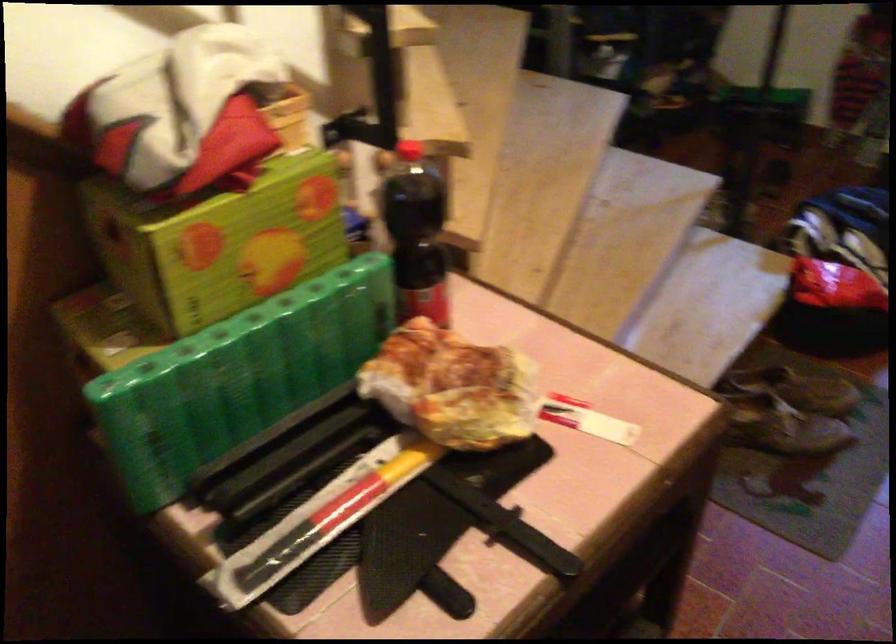
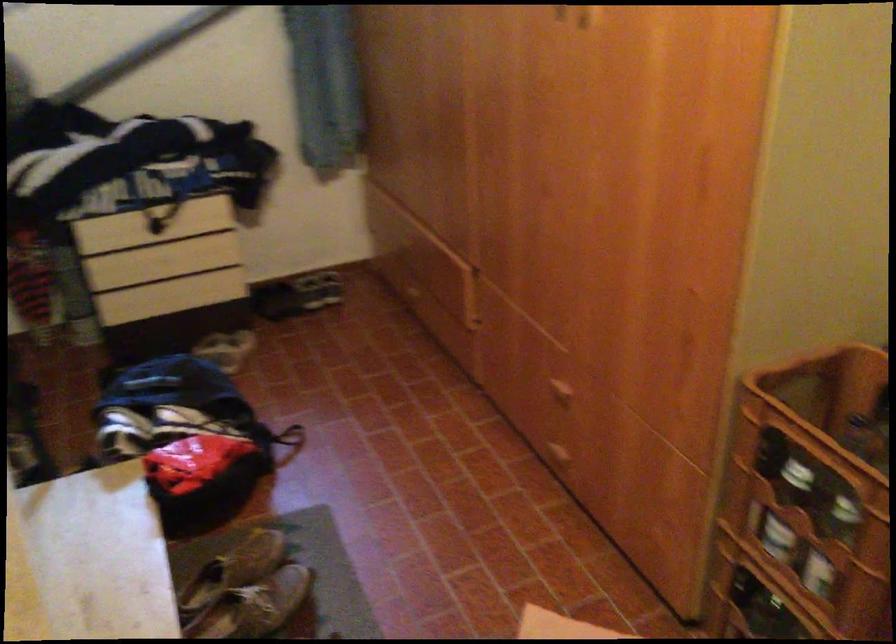
Question: The camera is either moving clockwise (left) or counter-clockwise (right) around the object. The first image is from the beginning of the video and the second image is from the end. Is the camera moving left or right when shooting the video?

Choices:
 (A) Left
 (B) Right

Answer: (A)